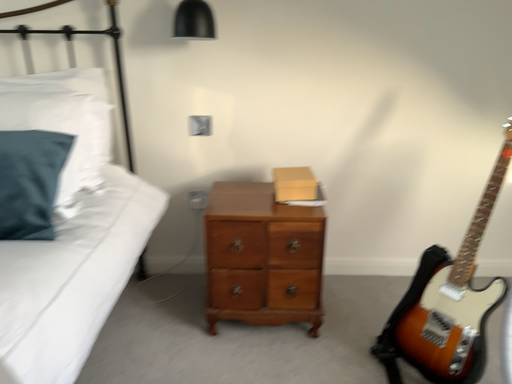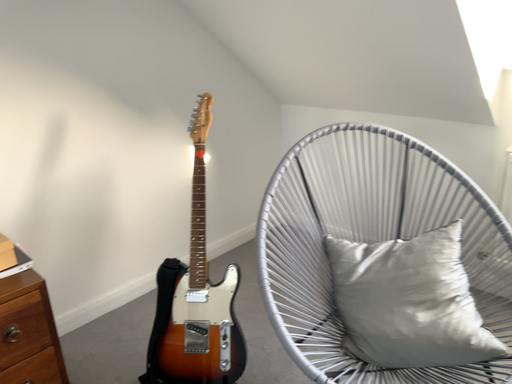
Question: How did the camera likely rotate when shooting the video?

Choices:
 (A) rotated upward
 (B) rotated downward

Answer: (A)